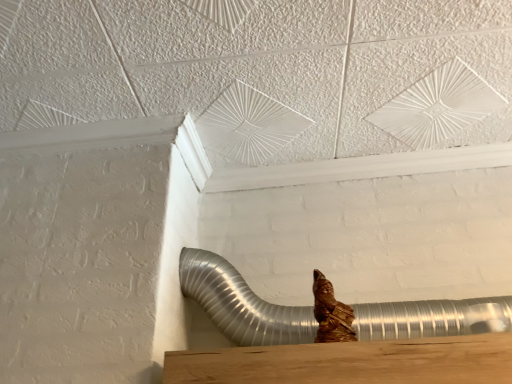
Where is `brown textured fabric at center`? This screenshot has height=384, width=512. brown textured fabric at center is located at coordinates (331, 313).

The width and height of the screenshot is (512, 384). Describe the element at coordinates (331, 313) in the screenshot. I see `brown textured fabric at center` at that location.

Image resolution: width=512 pixels, height=384 pixels. Find the location of `brown textured fabric at center`. brown textured fabric at center is located at coordinates (331, 313).